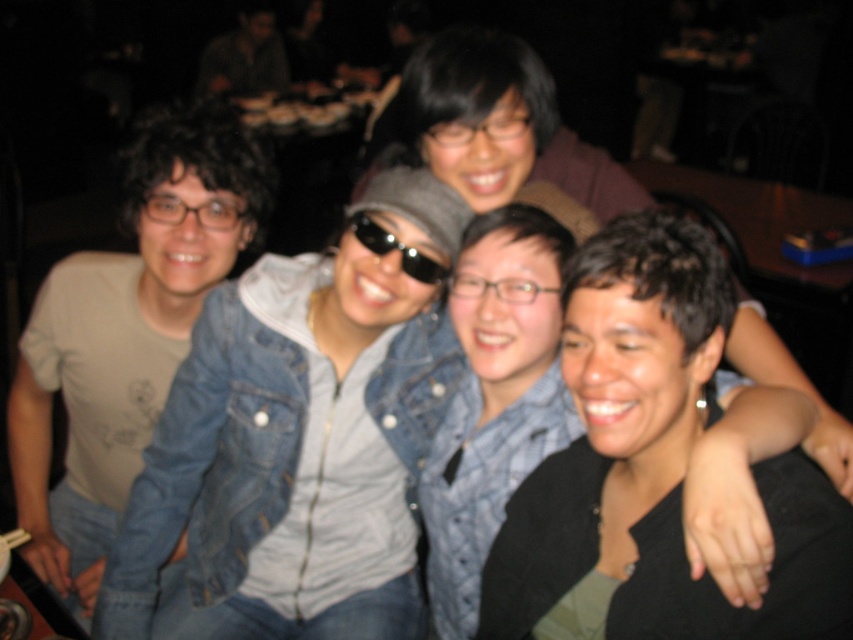
Which of these two, black matte jacket at center or denim jacket at center, stands shorter?

denim jacket at center is shorter.

Does black matte jacket at center appear on the right side of denim jacket at center?

Indeed, black matte jacket at center is positioned on the right side of denim jacket at center.

Where is `black matte jacket at center`? The image size is (853, 640). black matte jacket at center is located at coordinates (653, 467).

Locate an element on the screen. black matte jacket at center is located at coordinates (653, 467).

Is black matte jacket at center wider than light beige t-shirt at left?

Incorrect, black matte jacket at center's width does not surpass light beige t-shirt at left's.

Is point (602, 432) more distant than point (91, 580)?

No, it is not.

Locate an element on the screen. black matte jacket at center is located at coordinates (653, 467).

Between light beige t-shirt at left and sunglasses at center, which one has more height?

With more height is light beige t-shirt at left.

Who is more distant from viewer, (39, 464) or (395, 237)?

Point (39, 464)

Locate an element on the screen. This screenshot has height=640, width=853. light beige t-shirt at left is located at coordinates pos(126,332).